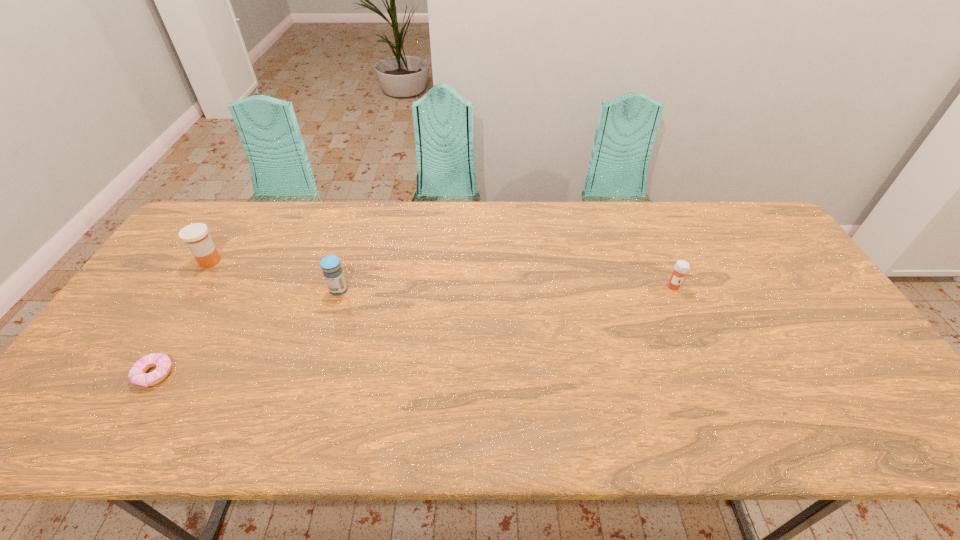
Identify the location of free space between the farthest medicine and the rightmost medicine. This screenshot has width=960, height=540. (442, 274).

Where is `vacant area that lies between the shortest medicine and the farthest medicine`? vacant area that lies between the shortest medicine and the farthest medicine is located at coordinates (442, 274).

Where is `vacant point located between the leftmost medicine and the rightmost medicine`? The image size is (960, 540). vacant point located between the leftmost medicine and the rightmost medicine is located at coordinates (442, 274).

Find the location of `empty space between the shortest object and the farthest medicine`. empty space between the shortest object and the farthest medicine is located at coordinates (182, 318).

Where is `free space that is in between the second medicine from left to right and the shortest object`? The image size is (960, 540). free space that is in between the second medicine from left to right and the shortest object is located at coordinates (247, 332).

You are a GUI agent. You are given a task and a screenshot of the screen. Output one action in this format:
    pyautogui.click(x=<x>, y=<y>)
    Task: Click on the vacant space in between the second object from right to left and the leftmost medicine
    
    Given the screenshot: What is the action you would take?
    pyautogui.click(x=275, y=275)

Locate an element on the screen. This screenshot has width=960, height=540. the third closest object to the rightmost object is located at coordinates (196, 237).

The width and height of the screenshot is (960, 540). I want to click on object that can be found as the closest to the second medicine from right to left, so click(x=196, y=237).

Choose which medicine is the second nearest neighbor to the farthest medicine. Please provide its 2D coordinates. Your answer should be formatted as a tuple, i.e. [(x, y)], where the tuple contains the x and y coordinates of a point satisfying the conditions above.

[(681, 267)]

Identify the location of the second closest medicine to the leftmost medicine. (681, 267).